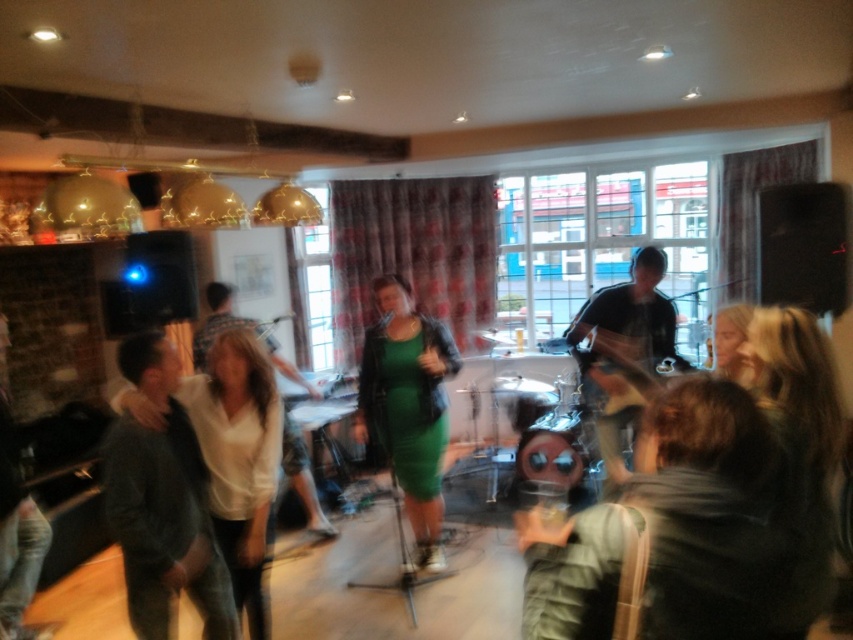
You are at the point labeled point (193,449) and want to move to the point labeled point (647,291). Is there a clear path between these two points without needing to go around any obstacles?

Yes, since point (193,449) is in front of point (647,291), there is a clear path between them without needing to go around obstacles.

In the scene shown: You are at a party and want to take a photo of both the dark green sweater at left and the green leather dress at center. Since you can only focus on one subject at a time, which one should you focus on to ensure the other is still in the background?

You should focus on the dark green sweater at left because it is positioned under the green leather dress at center, so focusing on the lower one will keep the upper one in the background.